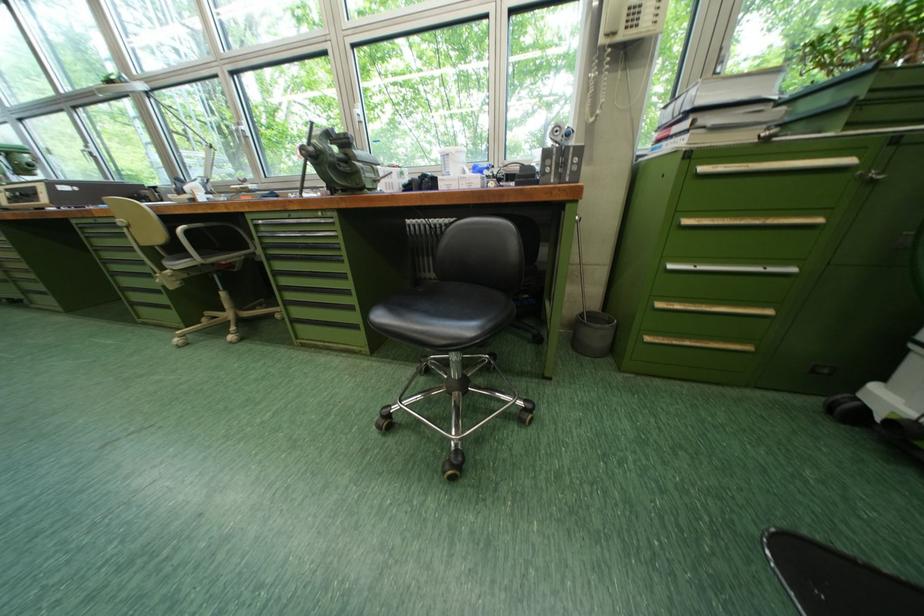
Describe the element at coordinates (358, 118) in the screenshot. I see `a white window handle` at that location.